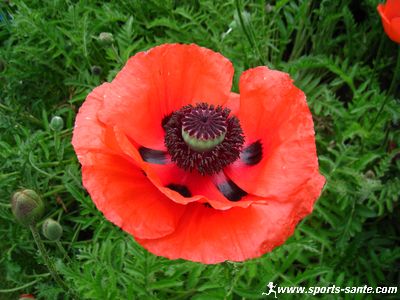
Image resolution: width=400 pixels, height=300 pixels. I want to click on pink shade, so click(88, 120).